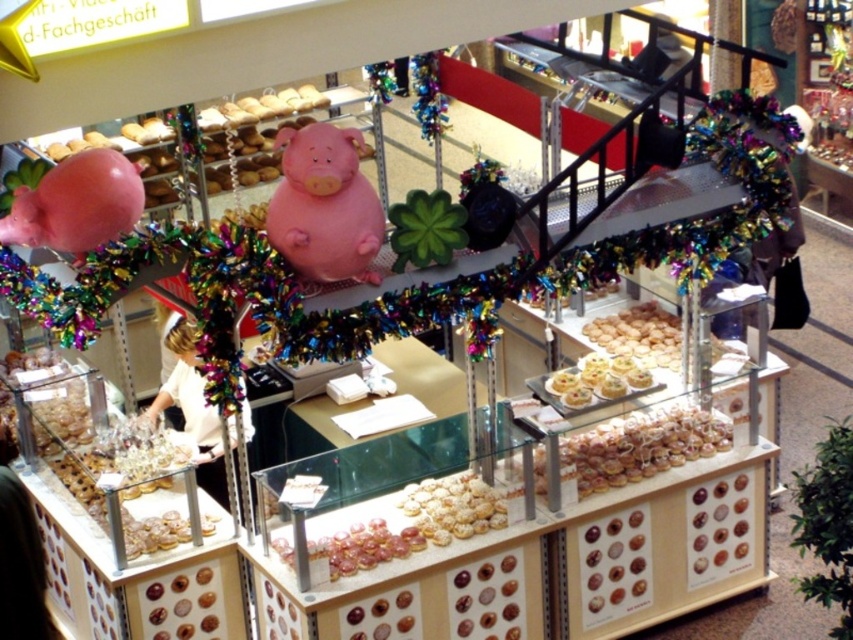
Based on the photo, between glazed doughnut at center and golden glazed cookies at center, which one appears on the right side from the viewer's perspective?

From the viewer's perspective, glazed doughnut at center appears more on the right side.

Is point (628, 432) closer to viewer compared to point (456, 509)?

That is False.

Which is behind, point (680, 458) or point (466, 522)?

The point (680, 458) is behind.

The width and height of the screenshot is (853, 640). Identify the location of glazed doughnut at center. (641, 445).

Is point (7, 243) positioned behind point (485, 490)?

No, it is not.

The width and height of the screenshot is (853, 640). I want to click on pink matte balloon at left, so click(76, 204).

Can you confirm if pink matte piggy bank at center is smaller than glazed doughnut at center?

Correct, pink matte piggy bank at center occupies less space than glazed doughnut at center.

Which is in front, point (303, 131) or point (715, 429)?

Point (303, 131) is in front.

Identify the location of pink matte piggy bank at center. (325, 205).